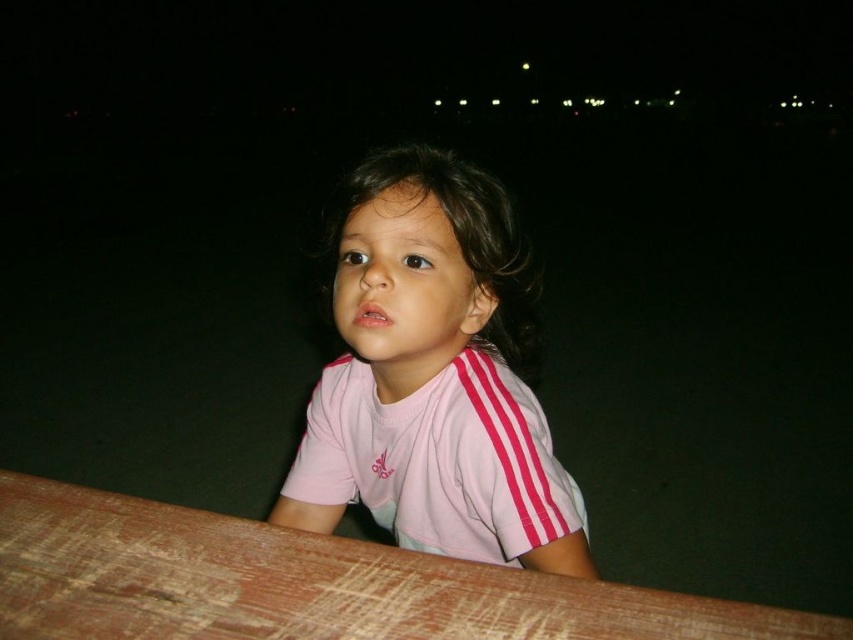
In the scene shown: What object is located at the coordinates point [433,376] in the image?

The point [433,376] corresponds to the pink fabric shirt at center.

You are a photographer setting up a night shoot. You notice the pink fabric shirt at center and the brown wooden table at lower center in the frame. Which object is closer to the camera based on their positions?

The pink fabric shirt at center is positioned over the brown wooden table at lower center, meaning it is closer to the camera.